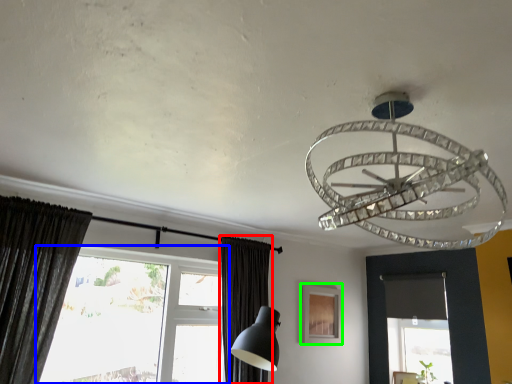
Question: Which object is the closest to the curtain (highlighted by a red box)? Choose among these: window (highlighted by a blue box) or picture frame (highlighted by a green box).

Choices:
 (A) window
 (B) picture frame

Answer: (A)